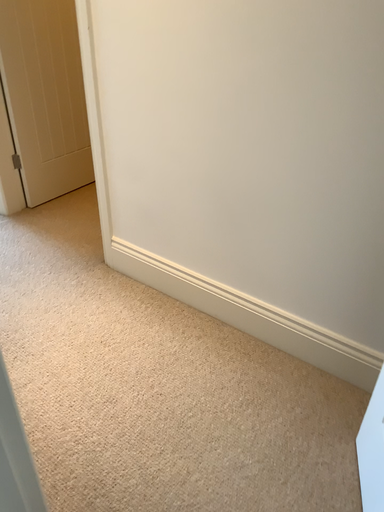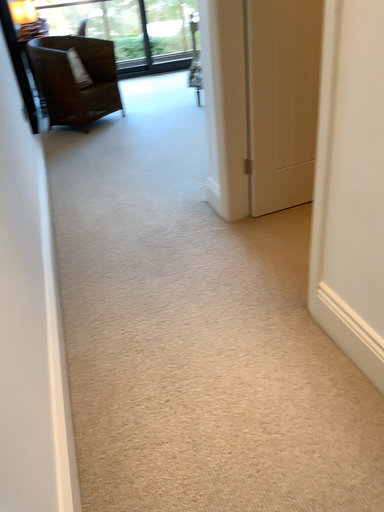
Question: Which way did the camera rotate in the video?

Choices:
 (A) rotated right
 (B) rotated left

Answer: (B)